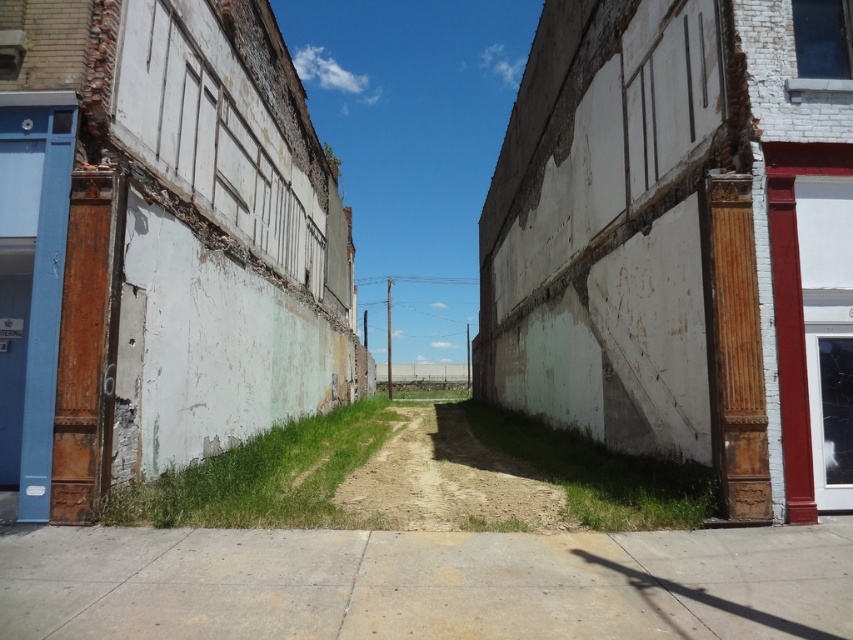
Question: Which of the following is the closest to the observer?

Choices:
 (A) concrete sidewalk at center
 (B) brown sandy dirt track at center

Answer: (A)

Question: Can you confirm if concrete sidewalk at center is bigger than brown sandy dirt track at center?

Choices:
 (A) no
 (B) yes

Answer: (A)

Question: Is concrete sidewalk at center to the left of brown sandy dirt track at center from the viewer's perspective?

Choices:
 (A) no
 (B) yes

Answer: (B)

Question: Which object appears farthest from the camera in this image?

Choices:
 (A) concrete sidewalk at center
 (B) brown sandy dirt track at center

Answer: (B)

Question: Which of the following is the farthest from the observer?

Choices:
 (A) (311, 598)
 (B) (471, 474)

Answer: (B)

Question: Is concrete sidewalk at center bigger than brown sandy dirt track at center?

Choices:
 (A) no
 (B) yes

Answer: (A)